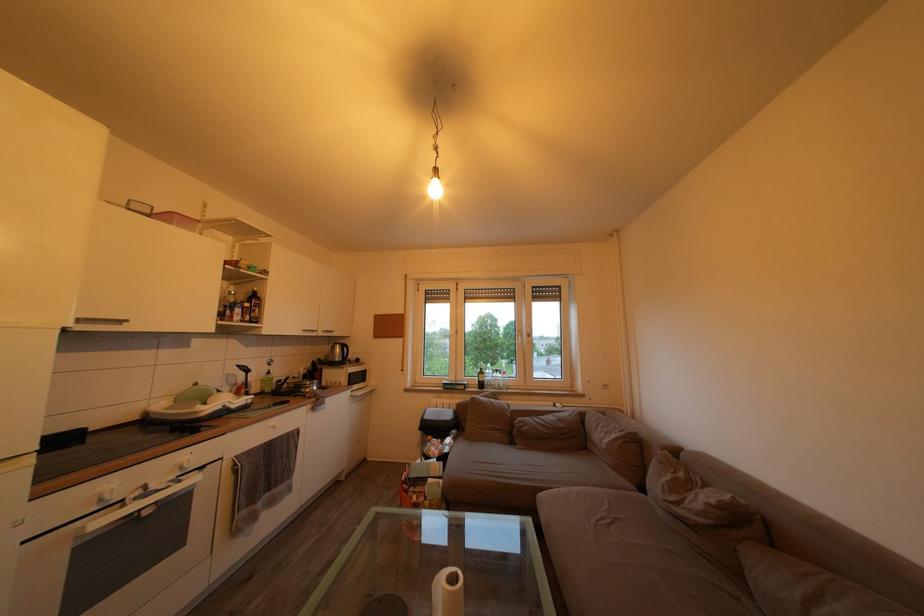
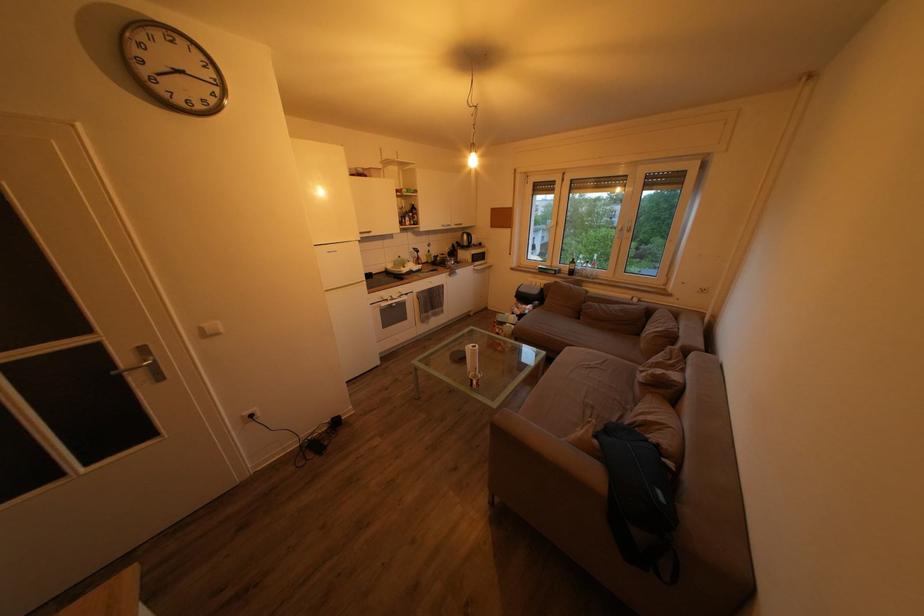
In the second image, find the point that corresponds to point (590, 424) in the first image.

(657, 318)